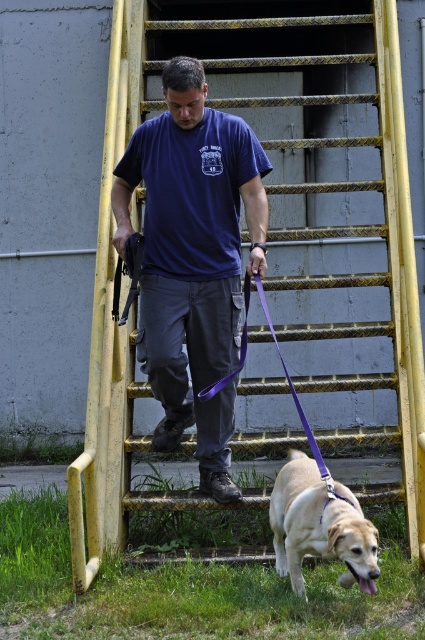
Can you confirm if yellow metallic ladder at center is positioned to the right of blue cotton shirt at center?

Indeed, yellow metallic ladder at center is positioned on the right side of blue cotton shirt at center.

Is yellow metallic ladder at center taller than blue cotton shirt at center?

Indeed, yellow metallic ladder at center has a greater height compared to blue cotton shirt at center.

Does point (297, 160) come closer to viewer compared to point (218, 456)?

No, it is behind (218, 456).

This screenshot has width=425, height=640. Identify the location of yellow metallic ladder at center. (266, 202).

Which is above, blue cotton shirt at center or golden fur dog at lower center?

Positioned higher is blue cotton shirt at center.

This screenshot has width=425, height=640. Identify the location of blue cotton shirt at center. (192, 259).

Locate an element on the screen. This screenshot has height=640, width=425. blue cotton shirt at center is located at coordinates (192, 259).

Can you confirm if yellow metallic ladder at center is taller than golden fur dog at lower center?

Indeed, yellow metallic ladder at center has a greater height compared to golden fur dog at lower center.

Find the location of a particular element. This screenshot has height=640, width=425. yellow metallic ladder at center is located at coordinates (266, 202).